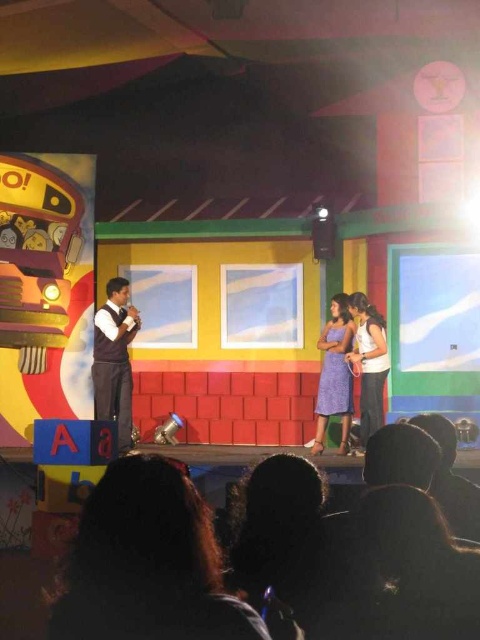
You are sitting in the audience watching the stage performance. There are two points marked on the stage. Which point is closer to you, point [108,307] or point [386,355]?

Point [108,307] is closer to the viewer than point [386,355].

You are a photographer setting up for the stage performance. You need to ensure that the dark brown hair at lower center and the lavender fabric dress at center are both visible in your shot. Based on their heights, which one might require you to adjust your camera angle upwards to capture fully?

The dark brown hair at lower center is not as tall as the lavender fabric dress at center, so you would need to adjust your camera angle upwards to capture the lavender fabric dress at center fully since it is taller.